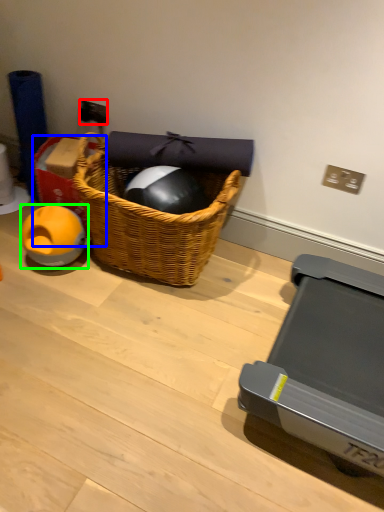
Question: Which object is positioned closest to power outlet (highlighted by a red box)? Select from box (highlighted by a blue box) and toy (highlighted by a green box).

Choices:
 (A) box
 (B) toy

Answer: (A)